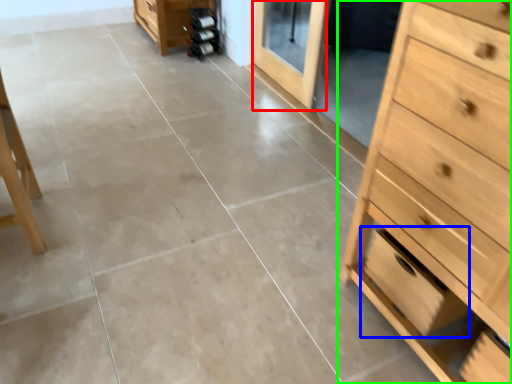
Question: Estimate the real-world distances between objects in this image. Which object is farther from screen door (highlighted by a red box), drawer (highlighted by a blue box) or chest of drawers (highlighted by a green box)?

Choices:
 (A) drawer
 (B) chest of drawers

Answer: (B)